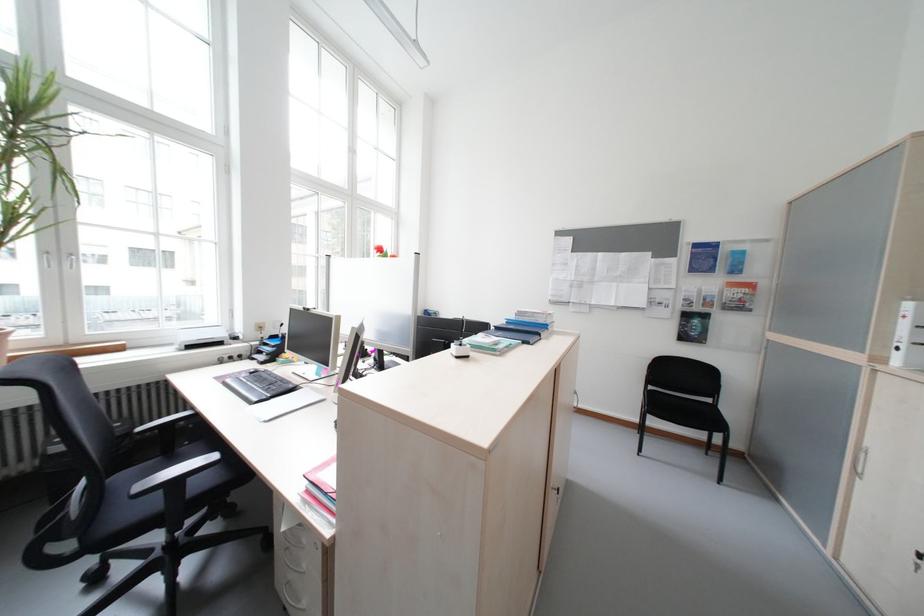
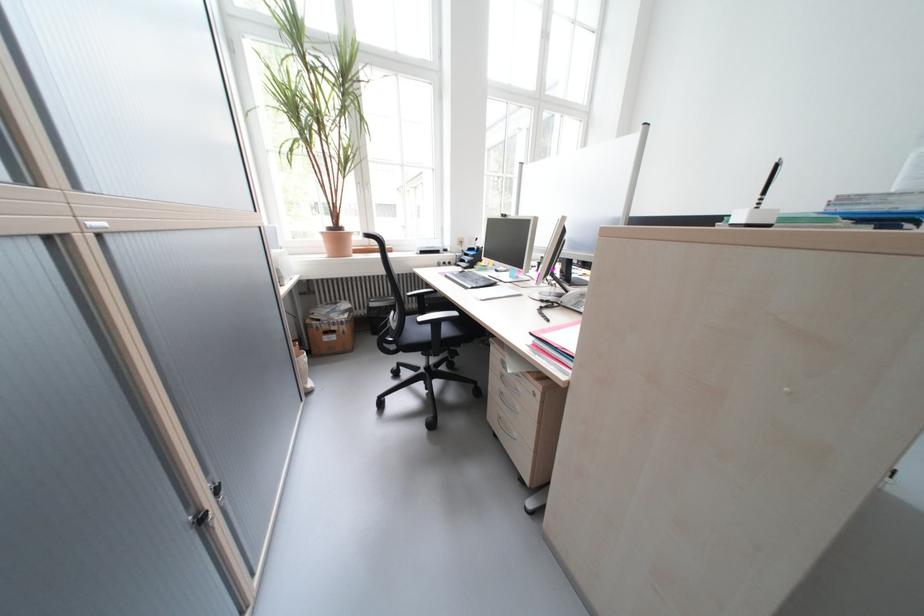
Locate, in the second image, the point that corresponds to (149,488) in the first image.

(431, 320)